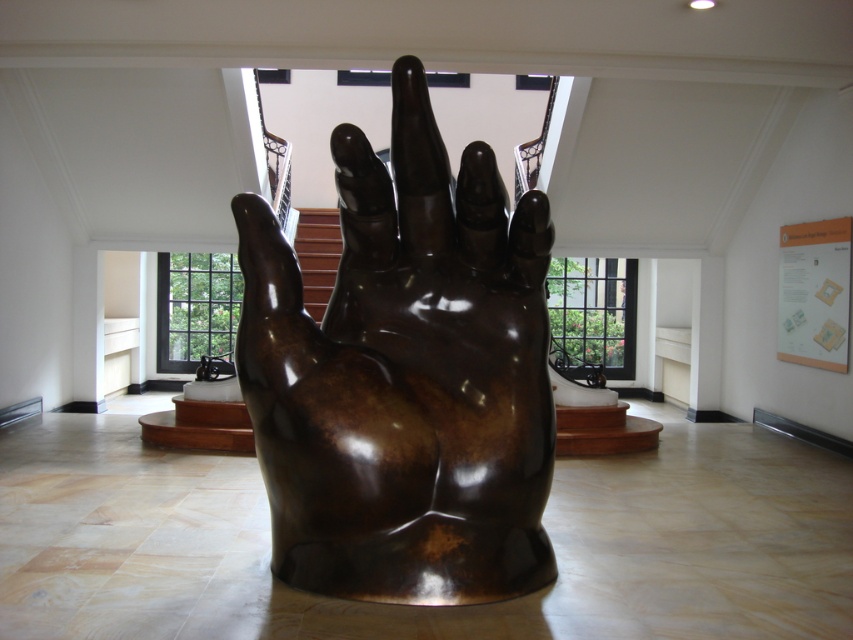
Question: Can you confirm if shiny bronze hand at center is thinner than brown wooden stairs at center?

Choices:
 (A) yes
 (B) no

Answer: (B)

Question: From the image, what is the correct spatial relationship of shiny bronze hand at center in relation to brown wooden stairs at center?

Choices:
 (A) right
 (B) left

Answer: (A)

Question: Which object appears closest to the camera in this image?

Choices:
 (A) shiny bronze hand at center
 (B) brown wooden stairs at center

Answer: (A)

Question: Among these objects, which one is farthest from the camera?

Choices:
 (A) brown wooden stairs at center
 (B) shiny bronze hand at center

Answer: (A)

Question: Is the position of shiny bronze hand at center more distant than that of brown wooden stairs at center?

Choices:
 (A) no
 (B) yes

Answer: (A)

Question: Which object appears farthest from the camera in this image?

Choices:
 (A) shiny bronze hand at center
 (B) brown wooden stairs at center

Answer: (B)